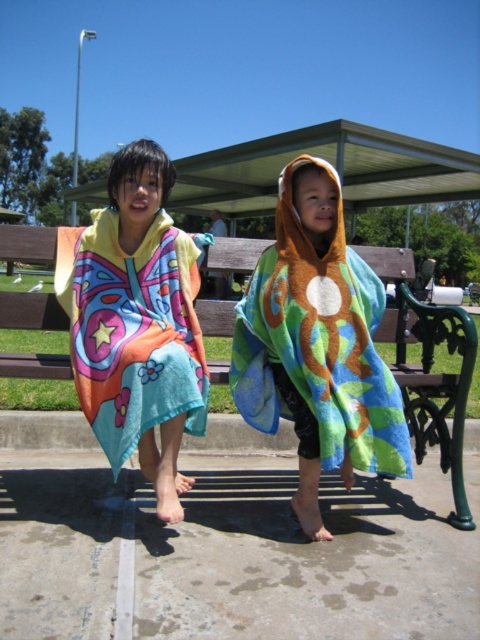
Question: Among these objects, which one is farthest from the camera?

Choices:
 (A) brown wooden bench at center
 (B) multicolored towel at center
 (C) multicolored towel at left

Answer: (A)

Question: Which object is farther from the camera taking this photo?

Choices:
 (A) multicolored towel at left
 (B) multicolored towel at center

Answer: (B)

Question: Can you confirm if multicolored towel at center is positioned below brown wooden bench at center?

Choices:
 (A) yes
 (B) no

Answer: (B)

Question: Which point is farther from the camera taking this photo?

Choices:
 (A) (457, 378)
 (B) (355, 435)

Answer: (A)

Question: Does multicolored towel at center come behind brown wooden bench at center?

Choices:
 (A) yes
 (B) no

Answer: (B)

Question: Considering the relative positions of multicolored towel at left and brown wooden bench at center in the image provided, where is multicolored towel at left located with respect to brown wooden bench at center?

Choices:
 (A) above
 (B) below

Answer: (A)